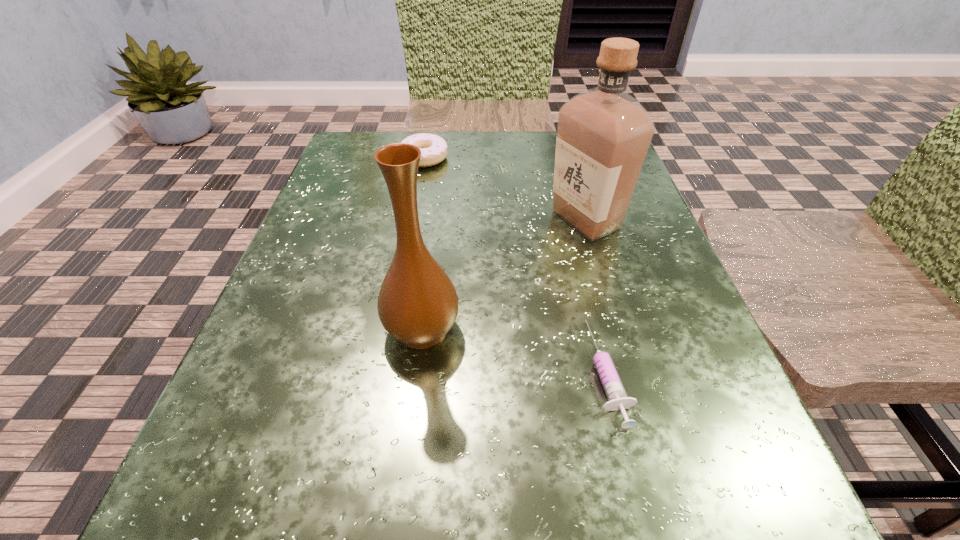
Where is `vacant space at the far left corner of the desktop`? This screenshot has height=540, width=960. vacant space at the far left corner of the desktop is located at coordinates (403, 136).

In order to click on vacant area that lies between the liquor and the farther syringe in this screenshot , I will do `click(597, 296)`.

This screenshot has height=540, width=960. I want to click on empty space that is in between the farther syringe and the doughnut, so click(516, 266).

The image size is (960, 540). In order to click on free space between the fourth tallest object and the vase in this screenshot , I will do `click(516, 351)`.

Identify which object is located as the second nearest to the farther syringe. Please provide its 2D coordinates. Your answer should be formatted as a tuple, i.e. [(x, y)], where the tuple contains the x and y coordinates of a point satisfying the conditions above.

[(603, 134)]

The height and width of the screenshot is (540, 960). I want to click on object that is the nearest to the vase, so click(617, 398).

At what (x,y) coordinates should I click in order to perform the action: click on free space that satisfies the following two spatial constraints: 1. on the front side of the farthest object; 2. on the left side of the vase. Please return your answer as a coordinate pair (x, y). This screenshot has width=960, height=540. Looking at the image, I should click on (393, 329).

Locate an element on the screen. This screenshot has height=540, width=960. free space that satisfies the following two spatial constraints: 1. on the front side of the farthest object; 2. on the left side of the right syringe is located at coordinates (385, 373).